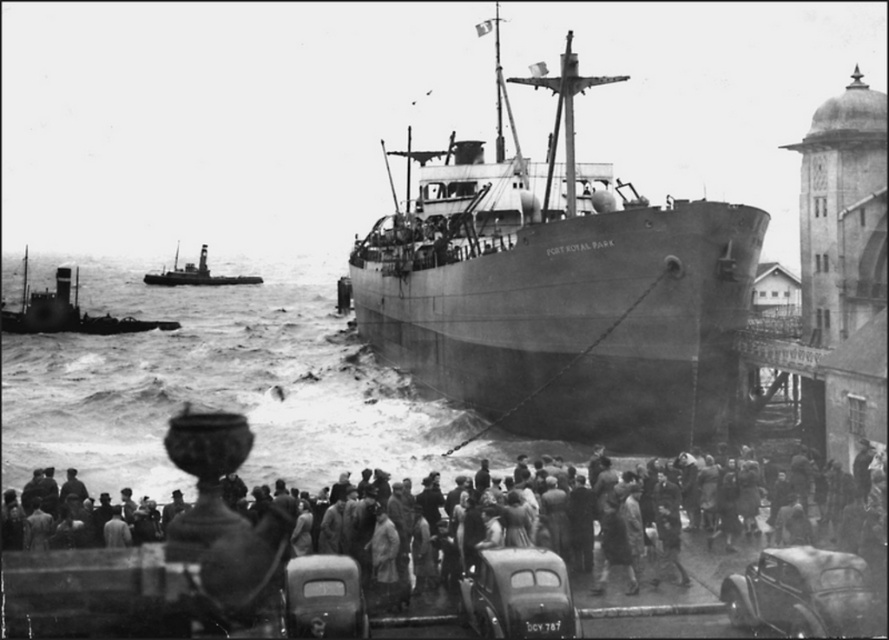
How much distance is there between shiny black car at lower right and brushed metal tugboat at upper left?

shiny black car at lower right is 904.19 feet away from brushed metal tugboat at upper left.

Can you confirm if shiny black car at lower right is smaller than brushed metal tugboat at upper left?

Yes, shiny black car at lower right is smaller than brushed metal tugboat at upper left.

Between point (787, 625) and point (191, 269), which one is positioned behind?

The point (191, 269) is more distant.

Find the location of `shiny black car at lower right`. shiny black car at lower right is located at coordinates (799, 593).

Does brushed metal tugboat at left have a smaller size compared to brushed metal tugboat at upper left?

No.

Between brushed metal tugboat at left and brushed metal tugboat at upper left, which one has more height?

Standing taller between the two is brushed metal tugboat at left.

You are a GUI agent. You are given a task and a screenshot of the screen. Output one action in this format:
    pyautogui.click(x=<x>, y=<y>)
    Task: Click on the brushed metal tugboat at left
    
    Given the screenshot: What is the action you would take?
    pyautogui.click(x=67, y=310)

At what (x,y) coordinates should I click in order to perform the action: click on brushed metal tugboat at left. Please return your answer as a coordinate pair (x, y). The image size is (889, 640). Looking at the image, I should click on (67, 310).

The width and height of the screenshot is (889, 640). Describe the element at coordinates (323, 596) in the screenshot. I see `matte gray car at lower center` at that location.

Is matte gray car at lower center wider than brushed metal tugboat at left?

No.

Between point (353, 564) and point (22, 301), which one is positioned behind?

The point (22, 301) is more distant.

The width and height of the screenshot is (889, 640). In order to click on matte gray car at lower center in this screenshot , I will do `click(323, 596)`.